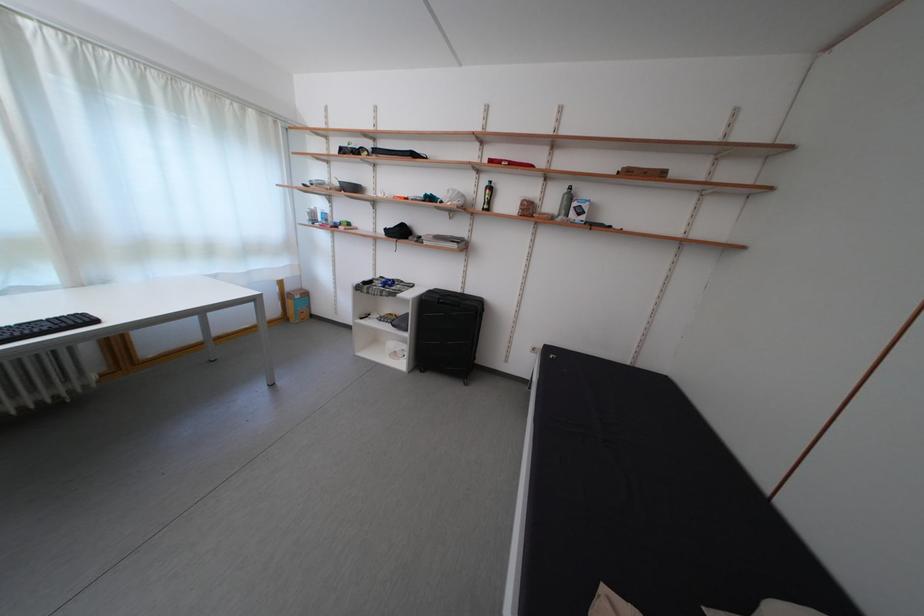
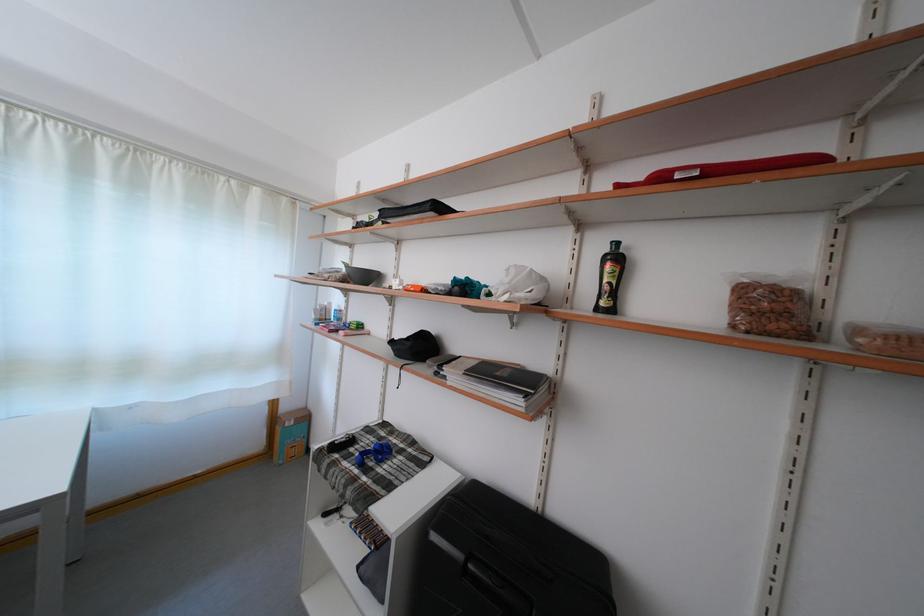
Question: Which direction would the cameraman need to move to produce the second image? Reply with the corresponding letter.

Choices:
 (A) Left
 (B) Right
 (C) Forward
 (D) Backward

Answer: (C)